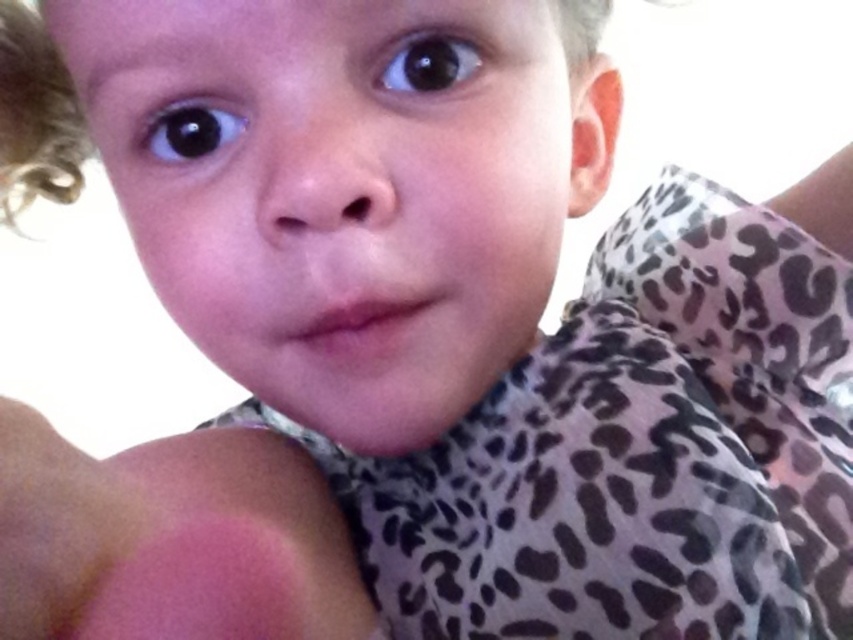
Between blonde curly hair at upper left and black glossy eye at upper left, which one has less height?

With less height is black glossy eye at upper left.

Image resolution: width=853 pixels, height=640 pixels. What do you see at coordinates (35, 116) in the screenshot?
I see `blonde curly hair at upper left` at bounding box center [35, 116].

Where is `blonde curly hair at upper left`? Image resolution: width=853 pixels, height=640 pixels. blonde curly hair at upper left is located at coordinates (35, 116).

In the scene shown: Is pink matte blush at lower left wider than black glossy eye at upper left?

Correct, the width of pink matte blush at lower left exceeds that of black glossy eye at upper left.

Can you confirm if pink matte blush at lower left is positioned below black glossy eye at upper left?

Indeed, pink matte blush at lower left is positioned under black glossy eye at upper left.

Which is behind, point (213, 472) or point (202, 104)?

The point (213, 472) is behind.

Identify the location of pink matte blush at lower left. This screenshot has height=640, width=853. (170, 540).

Does pink matte blush at lower left appear on the left side of black glossy eye at upper center?

Correct, you'll find pink matte blush at lower left to the left of black glossy eye at upper center.

Does pink matte blush at lower left have a greater height compared to black glossy eye at upper center?

Yes.

Is point (219, 554) more distant than point (402, 67)?

That is False.

Find the location of a particular element. The image size is (853, 640). pink matte blush at lower left is located at coordinates pyautogui.click(x=170, y=540).